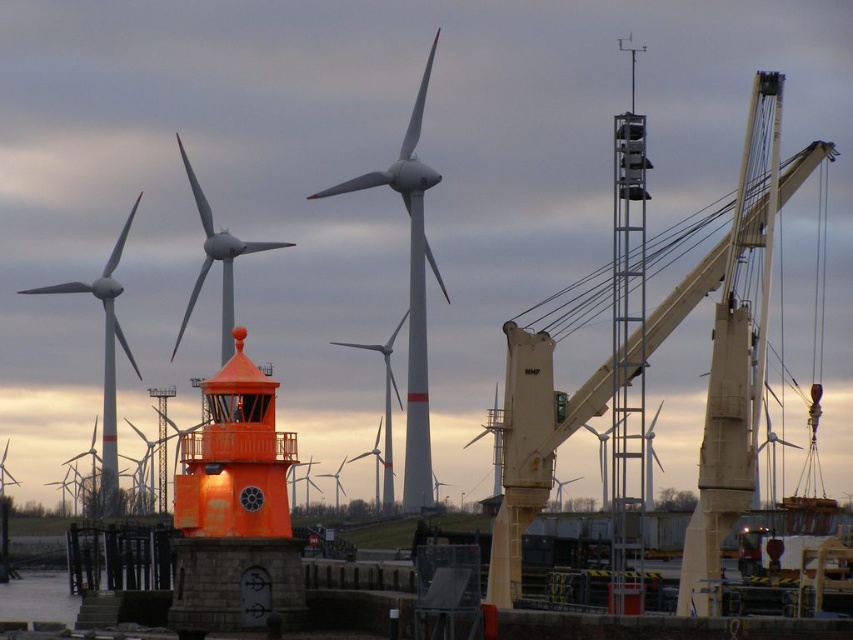
Is white matte wind turbine at center smaller than white matte windmill at left?

Yes.

Does white matte wind turbine at center have a greater height compared to white matte windmill at left?

Yes.

What do you see at coordinates (410, 291) in the screenshot? I see `white matte wind turbine at center` at bounding box center [410, 291].

Find the location of a particular element. white matte wind turbine at center is located at coordinates (410, 291).

Looking at this image, who is more forward, (567,404) or (416,241)?

Point (567,404)

Is beige metallic crane at right closer to camera compared to white matte wind turbine at center?

Yes, beige metallic crane at right is closer to the viewer.

Is point (722, 268) positioned in front of point (415, 141)?

Yes.

This screenshot has width=853, height=640. I want to click on beige metallic crane at right, so click(730, 342).

Describe the element at coordinates (730, 342) in the screenshot. Image resolution: width=853 pixels, height=640 pixels. I see `beige metallic crane at right` at that location.

Can you confirm if beige metallic crane at right is thinner than white matte windmill at left?

Yes, beige metallic crane at right is thinner than white matte windmill at left.

Is point (700, 461) farther from camera compared to point (113, 292)?

No, it is not.

Where is `beige metallic crane at right`? The height and width of the screenshot is (640, 853). beige metallic crane at right is located at coordinates (730, 342).